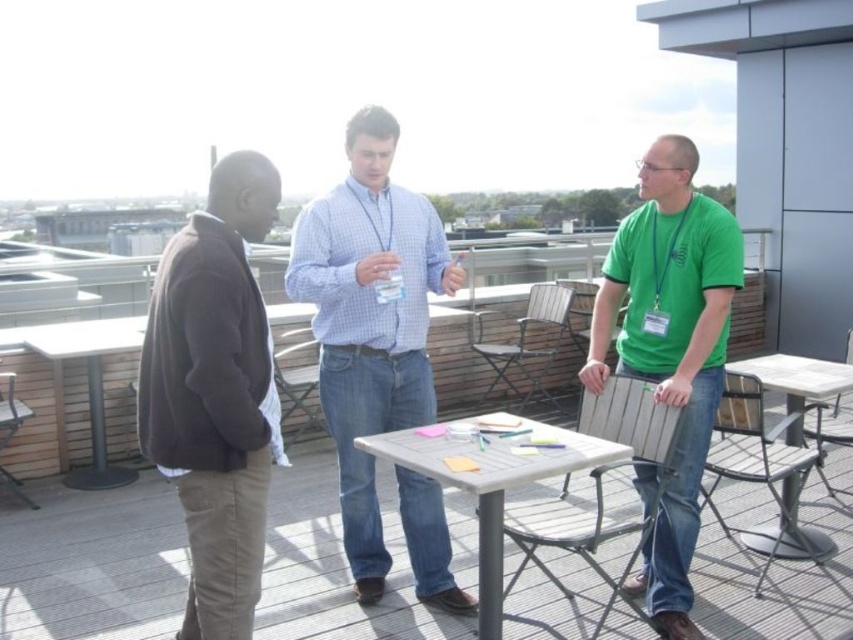
Question: Which object is closer to the camera taking this photo?

Choices:
 (A) metallic silver chair at left
 (B) wooden at center

Answer: (B)

Question: Which object is positioned farthest from the dark brown sweater at left?

Choices:
 (A) light blue checkered shirt at center
 (B) wooden chair at center

Answer: (B)

Question: Is light blue checkered shirt at center closer to camera compared to wooden chair at center?

Choices:
 (A) yes
 (B) no

Answer: (A)

Question: Considering the real-world distances, which object is farthest from the wooden at center?

Choices:
 (A) dark brown sweater at left
 (B) white plastic table at right

Answer: (A)

Question: Is white plastic table at center to the right of wooden at center from the viewer's perspective?

Choices:
 (A) yes
 (B) no

Answer: (B)

Question: Does green cotton shirt at center have a larger size compared to white plastic table at right?

Choices:
 (A) yes
 (B) no

Answer: (A)